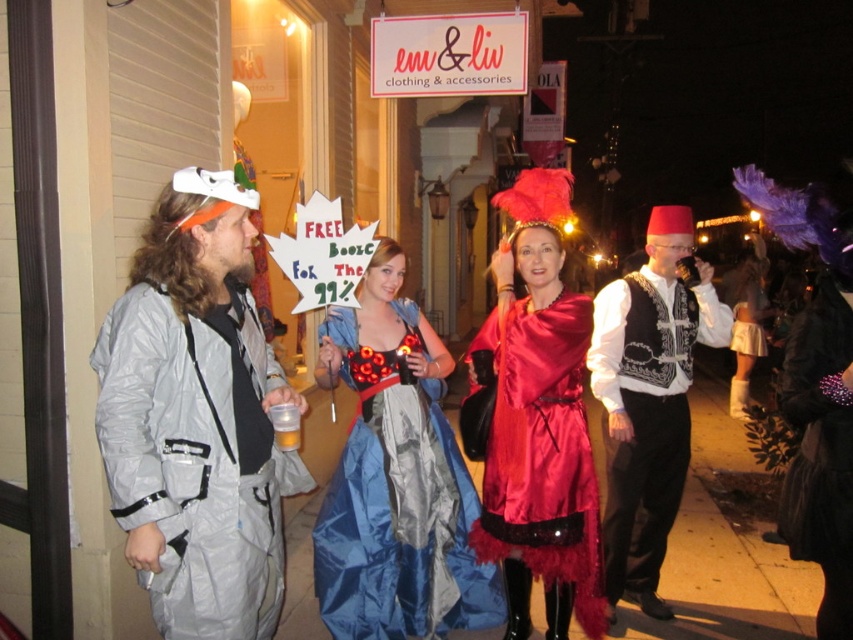
Question: Is white embroidered vest at center positioned at the back of black furry coat at right?

Choices:
 (A) no
 (B) yes

Answer: (B)

Question: Which object is closer to the camera taking this photo?

Choices:
 (A) silver metallic jumpsuit at left
 (B) white embroidered vest at center

Answer: (A)

Question: Which point is closer to the camera taking this photo?

Choices:
 (A) (755, 355)
 (B) (357, 593)

Answer: (B)

Question: Which object is the farthest from the white embroidered vest at center?

Choices:
 (A) translucent plastic cup at lower left
 (B) blue satin dress at center
 (C) silver metallic jumpsuit at left
 (D) shiny red dress at center

Answer: (C)

Question: Is the position of blue satin dress at center less distant than that of translucent plastic cup at lower left?

Choices:
 (A) yes
 (B) no

Answer: (B)

Question: Does blue satin dress at center appear on the left side of black furry coat at right?

Choices:
 (A) yes
 (B) no

Answer: (A)